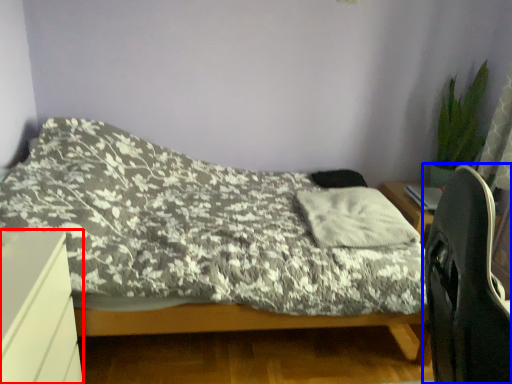
Question: Which object appears closest to the camera in this image, desk (highlighted by a red box) or computer chair (highlighted by a blue box)?

Choices:
 (A) desk
 (B) computer chair

Answer: (B)